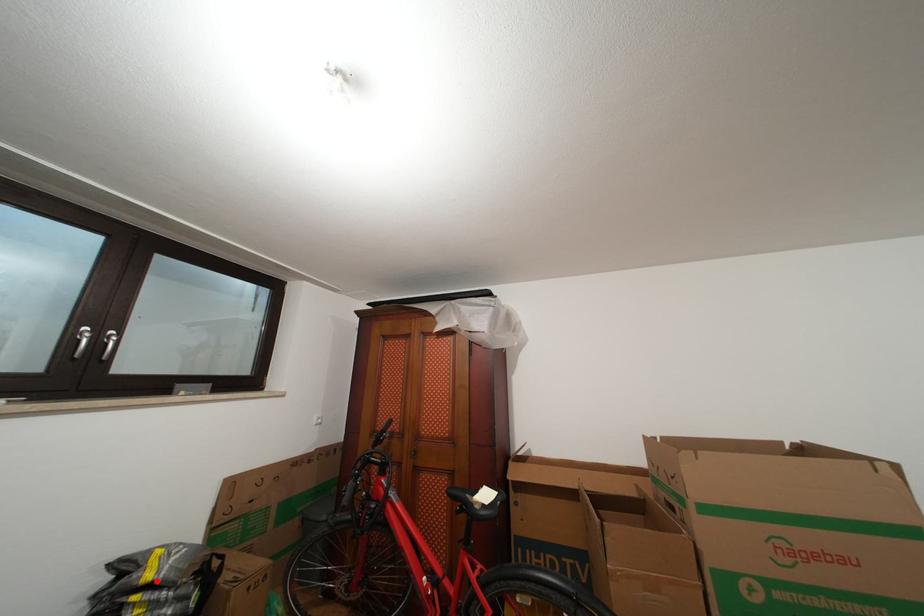
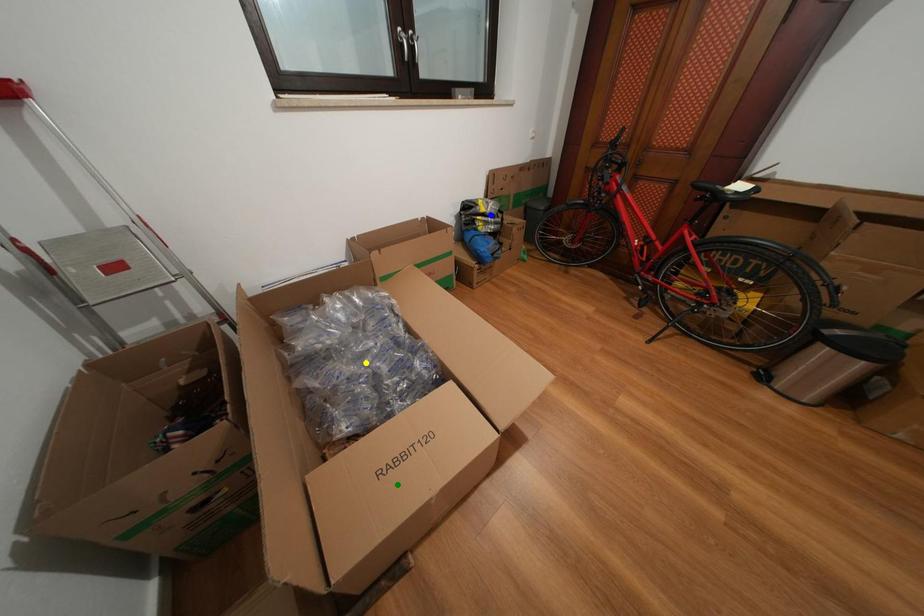
Question: I am providing you with two images of the same scene from different viewpoints. A red point is marked on the first image. You are given multiple points on the second image. Which spot in image 2 lines up with the point in image 1?

Choices:
 (A) blue point
 (B) green point
 (C) yellow point

Answer: (A)